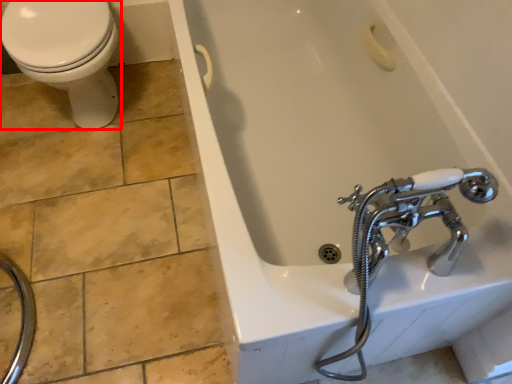
Question: From the image's perspective, where is bidet (annotated by the red box) located relative to bathtub?

Choices:
 (A) below
 (B) above

Answer: (B)